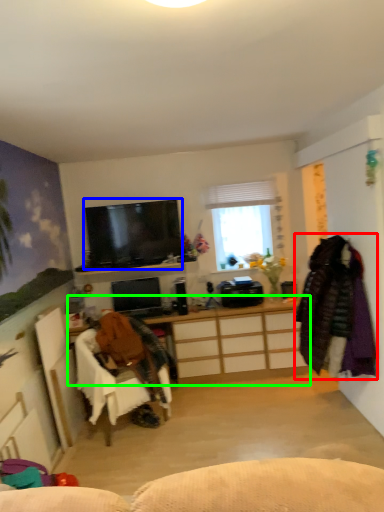
Question: Based on their relative distances, which object is nearer to clothing (highlighted by a red box)? Choose from television (highlighted by a blue box) and cabinetry (highlighted by a green box).

Choices:
 (A) television
 (B) cabinetry

Answer: (B)